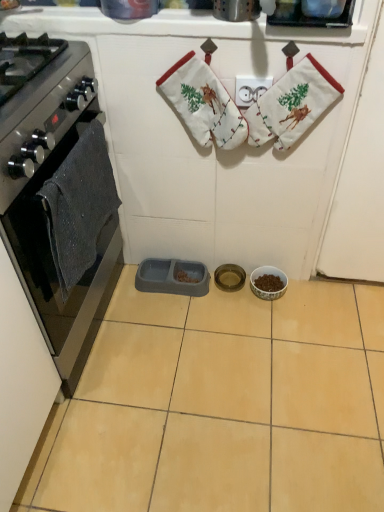
At what (x,y) coordinates should I click in order to perform the action: click on free location to the left of metallic gold bowl at center, arranged as the 2th appliance when viewed from the right. Please return your answer as a coordinate pair (x, y). The height and width of the screenshot is (512, 384). Looking at the image, I should click on (186, 302).